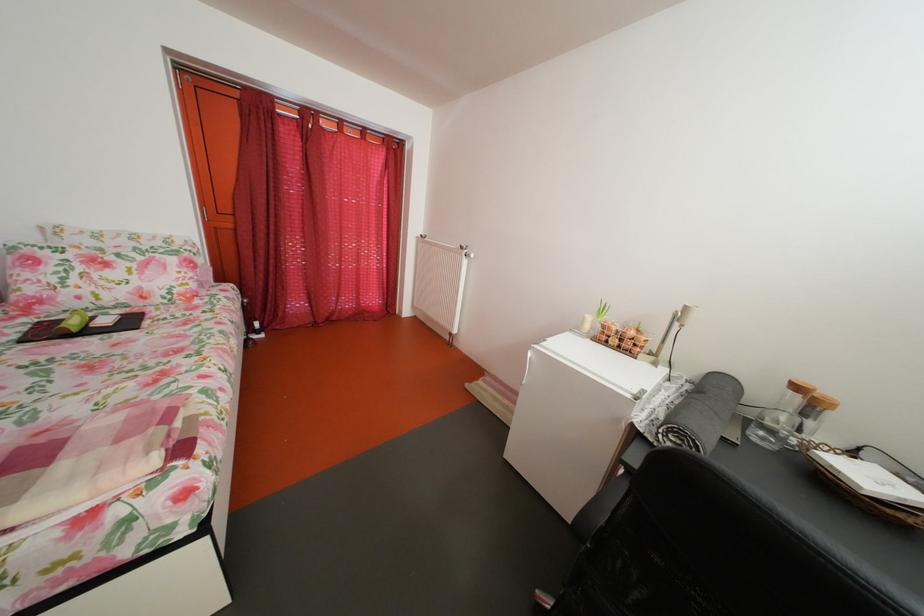
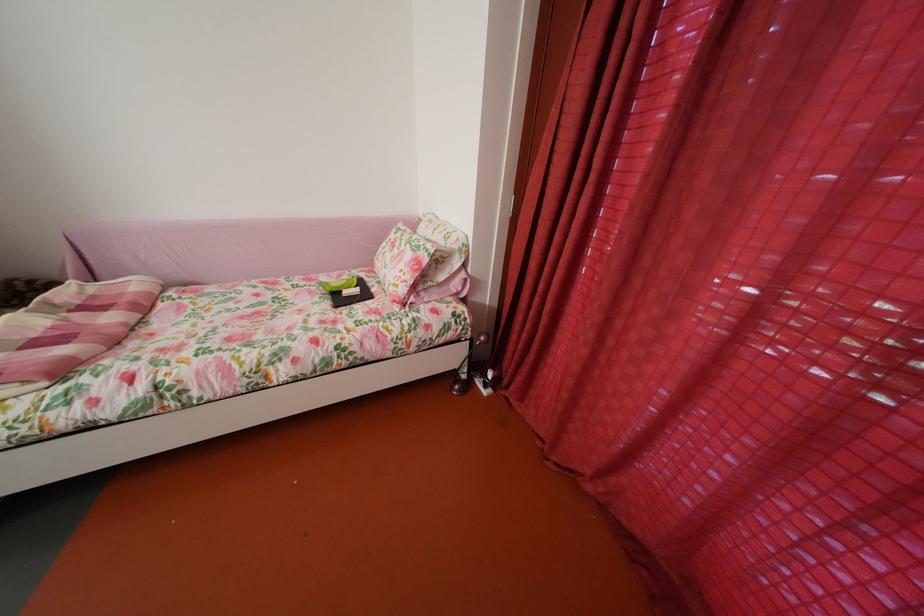
The point at [184,265] is marked in the first image. Where is the corresponding point in the second image?

(419, 262)